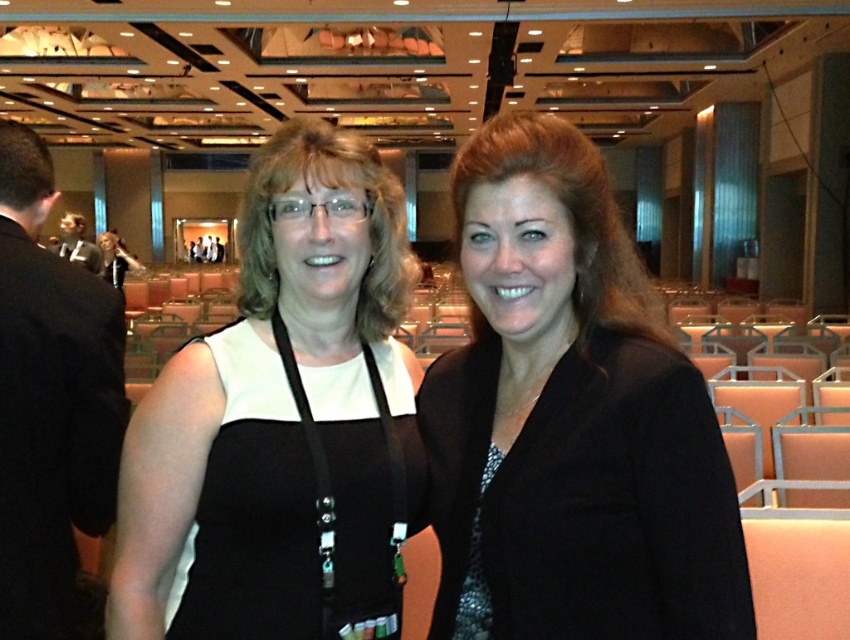
Question: Can you confirm if black fabric dress at center is wider than black fabric lanyard at center?

Choices:
 (A) yes
 (B) no

Answer: (A)

Question: Among these objects, which one is farthest from the camera?

Choices:
 (A) black fabric dress at center
 (B) black textured blazer at center

Answer: (A)

Question: Is black textured blazer at center further to camera compared to black fabric dress at center?

Choices:
 (A) yes
 (B) no

Answer: (B)

Question: Does black textured blazer at center appear on the left side of black fabric lanyard at center?

Choices:
 (A) no
 (B) yes

Answer: (A)

Question: Which object is closer to the camera taking this photo?

Choices:
 (A) black fabric dress at center
 (B) black fabric lanyard at center

Answer: (A)

Question: Which point is closer to the camera taking this photo?

Choices:
 (A) (353, 545)
 (B) (231, 620)
 (C) (463, 595)
 (D) (477, 234)

Answer: (D)